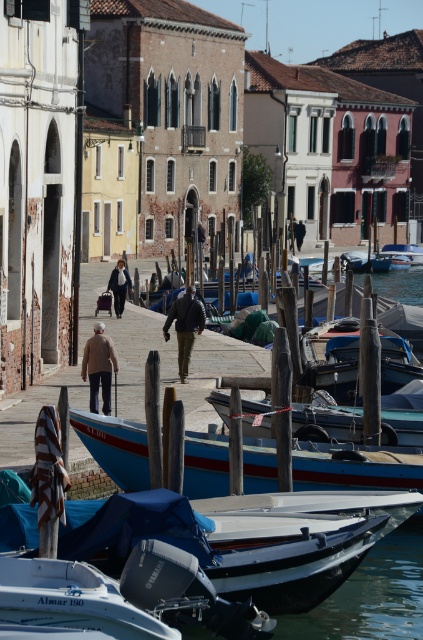
Question: Which object is farther from the camera taking this photo?

Choices:
 (A) blue wooden boat at center
 (B) teal matte boat at center
 (C) blue tarpaulin boat at lower center
 (D) blue painted wooden boat at lower center

Answer: (A)

Question: Which point appears farthest from the camera in this image?

Choices:
 (A) (142, 456)
 (B) (184, 353)

Answer: (B)

Question: Is teal matte boat at center wider than matte black coat at center?

Choices:
 (A) yes
 (B) no

Answer: (B)

Question: Which object is the farthest from the dark brown leather jacket at center?

Choices:
 (A) blue painted wooden boat at lower center
 (B) matte black coat at center
 (C) light brown wool coat at center

Answer: (B)

Question: Considering the relative positions of blue painted wooden boat at lower center and teal matte boat at center in the image provided, where is blue painted wooden boat at lower center located with respect to teal matte boat at center?

Choices:
 (A) left
 (B) right

Answer: (A)

Question: Is light brown wool coat at center above blue wooden boat at center?

Choices:
 (A) yes
 (B) no

Answer: (B)